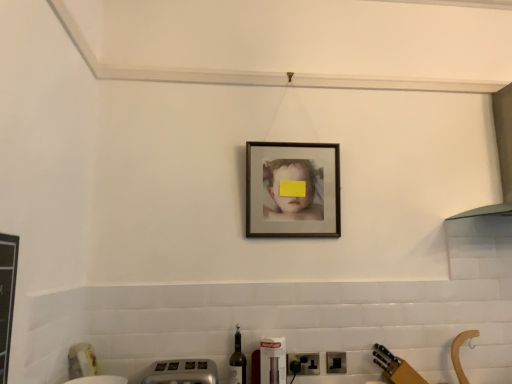
Question: Is black plastic electric outlet at lower center, placed as the second electric outlet when sorted from left to right, outside of metallic silver toaster at lower center?

Choices:
 (A) no
 (B) yes

Answer: (B)

Question: Considering the relative positions of black plastic electric outlet at lower center, positioned as the 1th electric outlet in right-to-left order, and metallic silver toaster at lower center in the image provided, is black plastic electric outlet at lower center, positioned as the 1th electric outlet in right-to-left order, to the right of metallic silver toaster at lower center from the viewer's perspective?

Choices:
 (A) no
 (B) yes

Answer: (B)

Question: Considering the relative sizes of black plastic electric outlet at lower center, placed as the second electric outlet when sorted from left to right, and metallic silver toaster at lower center in the image provided, is black plastic electric outlet at lower center, placed as the second electric outlet when sorted from left to right, shorter than metallic silver toaster at lower center?

Choices:
 (A) no
 (B) yes

Answer: (B)

Question: From the image's perspective, is black plastic electric outlet at lower center, positioned as the 1th electric outlet in right-to-left order, under metallic silver toaster at lower center?

Choices:
 (A) no
 (B) yes

Answer: (B)

Question: Is black plastic electric outlet at lower center, positioned as the 1th electric outlet in right-to-left order, bigger than metallic silver toaster at lower center?

Choices:
 (A) yes
 (B) no

Answer: (B)

Question: From a real-world perspective, is black plastic electric outlet at lower center, positioned as the 1th electric outlet in right-to-left order, on metallic silver toaster at lower center?

Choices:
 (A) no
 (B) yes

Answer: (B)

Question: Does translucent glass wine bottle at lower center come behind metallic silver toaster at lower center?

Choices:
 (A) yes
 (B) no

Answer: (A)

Question: Is translucent glass wine bottle at lower center at the right side of metallic silver toaster at lower center?

Choices:
 (A) yes
 (B) no

Answer: (A)

Question: Could metallic silver toaster at lower center be considered to be inside translucent glass wine bottle at lower center?

Choices:
 (A) no
 (B) yes

Answer: (A)

Question: Is translucent glass wine bottle at lower center looking in the opposite direction of metallic silver toaster at lower center?

Choices:
 (A) no
 (B) yes

Answer: (A)

Question: Considering the relative sizes of translucent glass wine bottle at lower center and metallic silver toaster at lower center in the image provided, is translucent glass wine bottle at lower center wider than metallic silver toaster at lower center?

Choices:
 (A) no
 (B) yes

Answer: (A)

Question: Is translucent glass wine bottle at lower center with metallic silver toaster at lower center?

Choices:
 (A) yes
 (B) no

Answer: (B)

Question: From the image's perspective, does metallic silver toaster at lower center appear lower than translucent glass wine bottle at lower center?

Choices:
 (A) yes
 (B) no

Answer: (B)